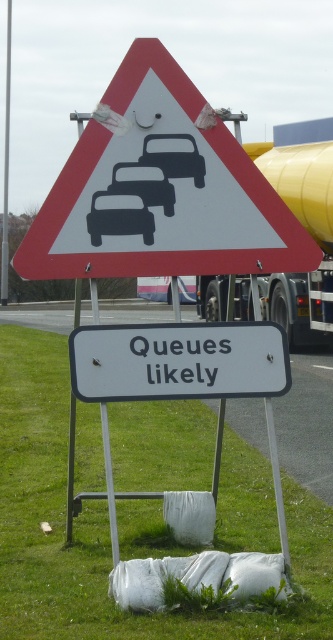
This screenshot has width=333, height=640. What are the coordinates of `white plastic triangle at center` in the screenshot? It's located at (159, 193).

Does white plastic triangle at center lie behind black glossy car at center?

No, white plastic triangle at center is in front of black glossy car at center.

What are the coordinates of `white plastic triangle at center` in the screenshot? It's located at (159, 193).

Can you confirm if green grass at lower center is smaller than matte black car at center?

No, green grass at lower center is not smaller than matte black car at center.

Is point (314, 628) positioned in front of point (145, 224)?

Yes, it is.

Between point (173, 449) and point (139, 196), which one is positioned in front?

Point (139, 196) is more forward.

Where is `green grass at lower center`? Image resolution: width=333 pixels, height=640 pixels. green grass at lower center is located at coordinates (107, 529).

Who is more distant from viewer, (x=11, y=582) or (x=235, y=147)?

The point (x=11, y=582) is behind.

Who is positioned more to the right, green grass at lower center or white plastic triangle at center?

From the viewer's perspective, white plastic triangle at center appears more on the right side.

Between point (11, 531) and point (62, 269), which one is positioned in front?

Point (62, 269) is more forward.

Locate an element on the screen. The width and height of the screenshot is (333, 640). green grass at lower center is located at coordinates (107, 529).